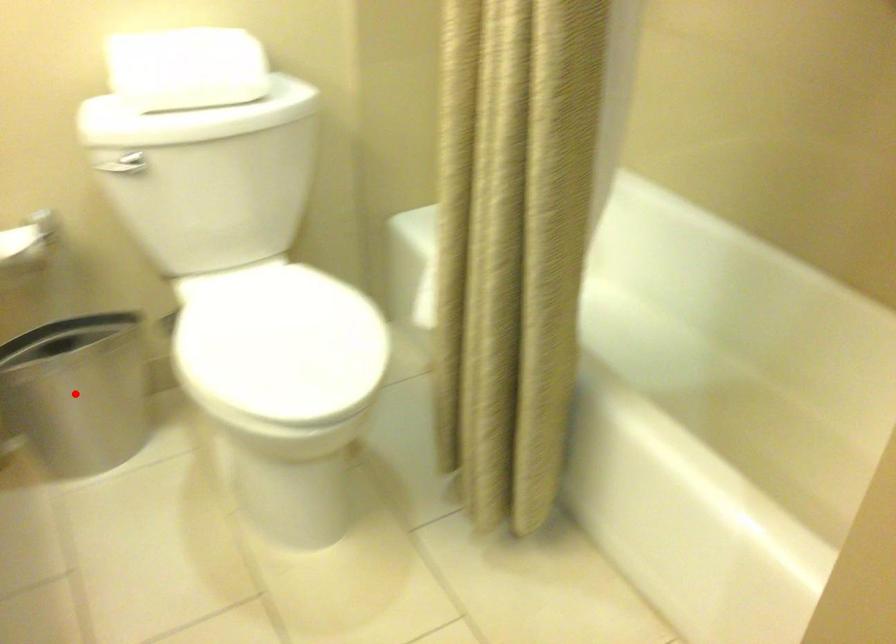
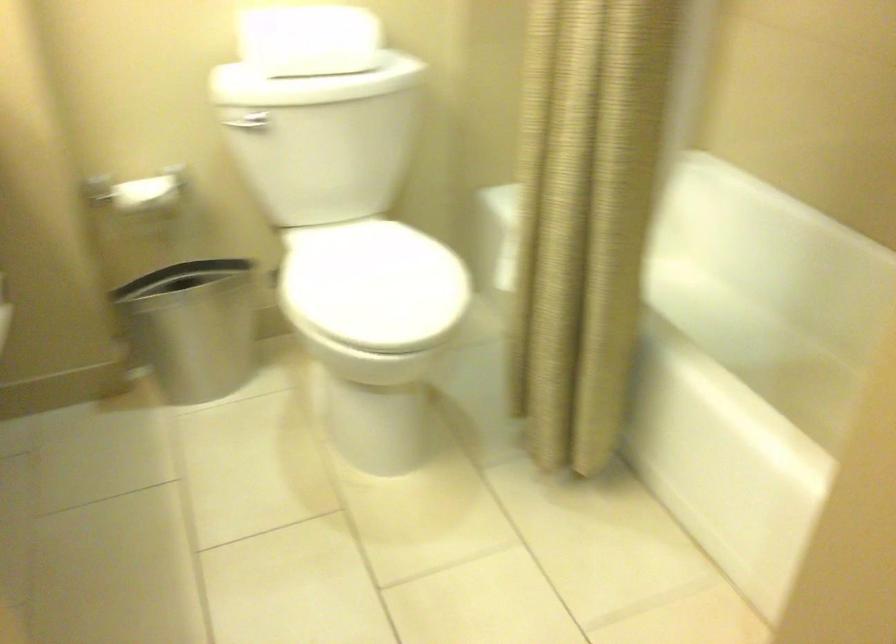
In the second image, find the point that corresponds to the highlighted location in the first image.

(194, 327)